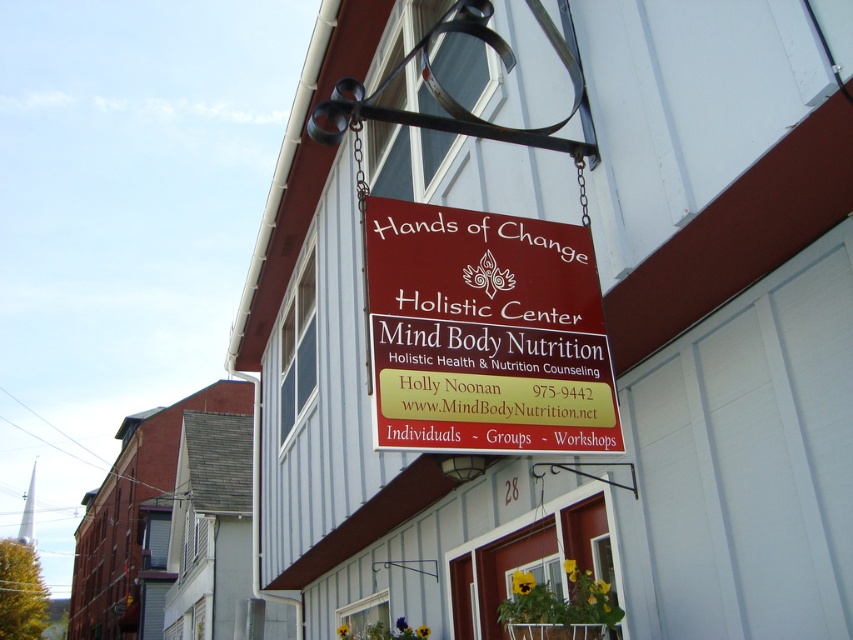
You are standing in front of the Hands of Change Holistic Center. You need to locate the matte red sign at center. Where is it positioned relative to the building entrance?

The matte red sign at center is positioned at the center of the building, hanging from a black metal bracket attached to the exterior.

You are a customer looking for the Holistic Center and see both the matte red sign at center and the maroon wood sign at center. Which sign is larger?

The maroon wood sign at center is larger than the matte red sign at center.